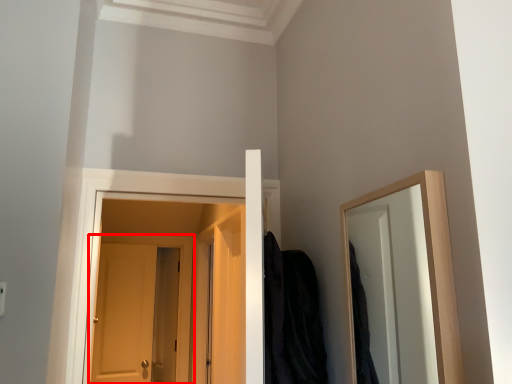
Question: From the image's perspective, what is the correct spatial positioning of door (annotated by the red box) in reference to robe?

Choices:
 (A) above
 (B) below

Answer: (B)